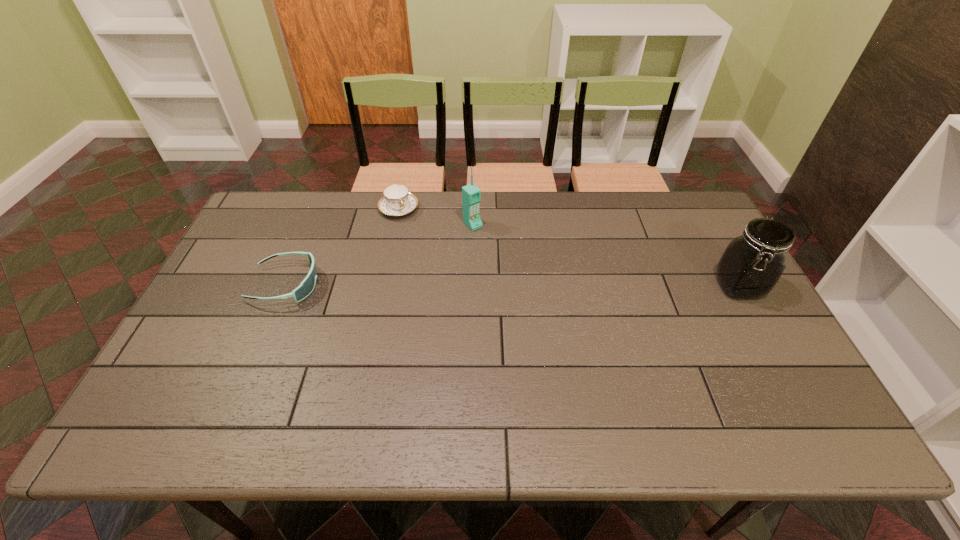
Find the location of `vacant space at the far right corner`. vacant space at the far right corner is located at coordinates (660, 206).

Locate an element on the screen. This screenshot has height=540, width=960. free space at the near right corner of the desktop is located at coordinates (759, 393).

I want to click on free spot between the rightmost object and the cellular telephone, so (606, 255).

What are the coordinates of `free space between the jar and the goggles` in the screenshot? It's located at (512, 286).

You are a GUI agent. You are given a task and a screenshot of the screen. Output one action in this format:
    pyautogui.click(x=<x>, y=<y>)
    Task: Click on the vacant space in between the cellular telephone and the teacup
    
    Given the screenshot: What is the action you would take?
    pyautogui.click(x=436, y=217)

Identify the location of free spot between the second object from right to left and the leftmost object. (379, 254).

Locate an element on the screen. This screenshot has height=540, width=960. blank region between the teacup and the goggles is located at coordinates (343, 247).

Locate an element on the screen. The height and width of the screenshot is (540, 960). vacant area that lies between the third object from left to right and the leftmost object is located at coordinates (379, 254).

The image size is (960, 540). I want to click on empty space between the jar and the third object from left to right, so click(606, 255).

Identify the location of free space between the teacup and the leftmost object. click(x=343, y=247).